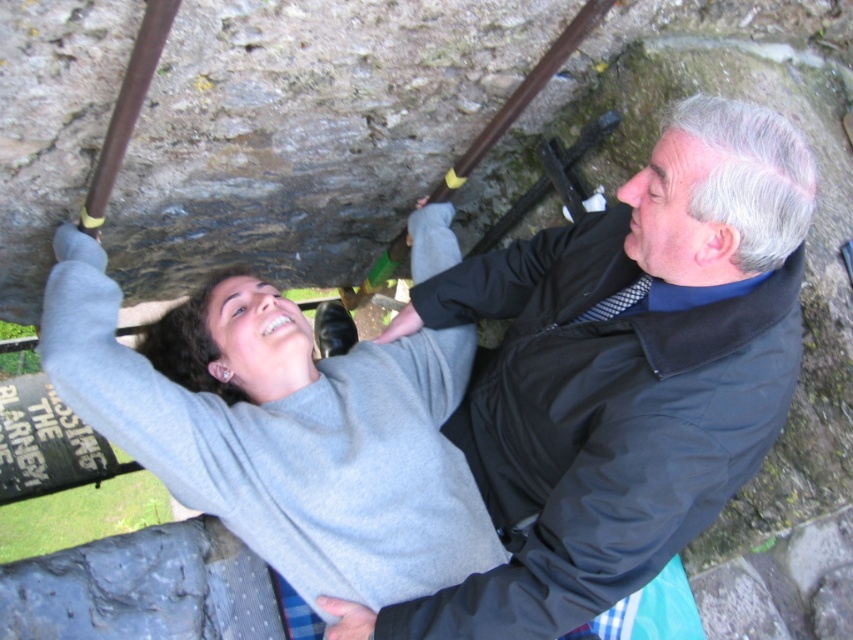
Between point (552, 600) and point (399, 522), which one is positioned behind?

The point (399, 522) is behind.

Who is positioned more to the left, black smooth jacket at upper right or gray matte sweater at upper center?

gray matte sweater at upper center

Does point (596, 538) lie behind point (231, 349)?

No, it is in front of (231, 349).

Find the location of a particular element. This screenshot has width=853, height=640. black smooth jacket at upper right is located at coordinates coord(619,376).